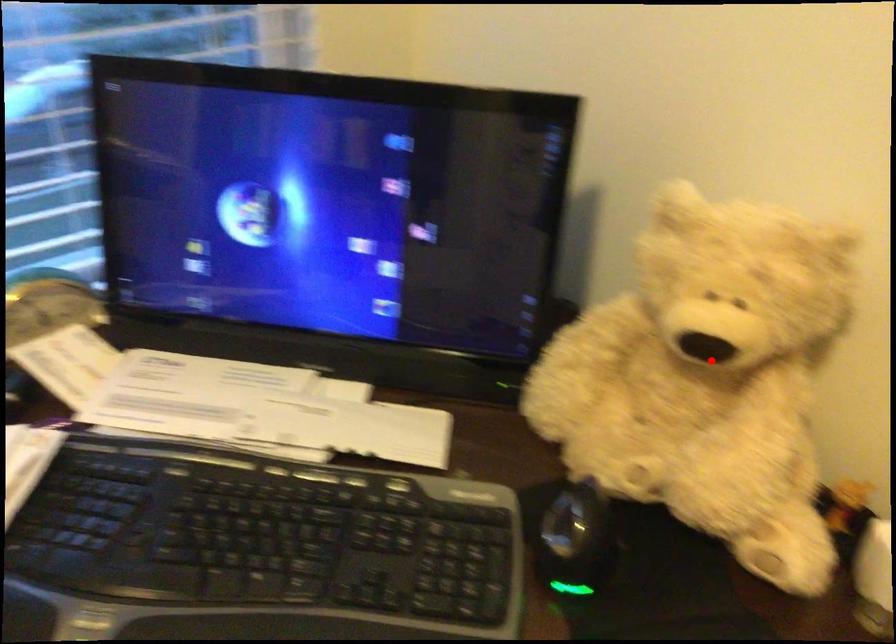
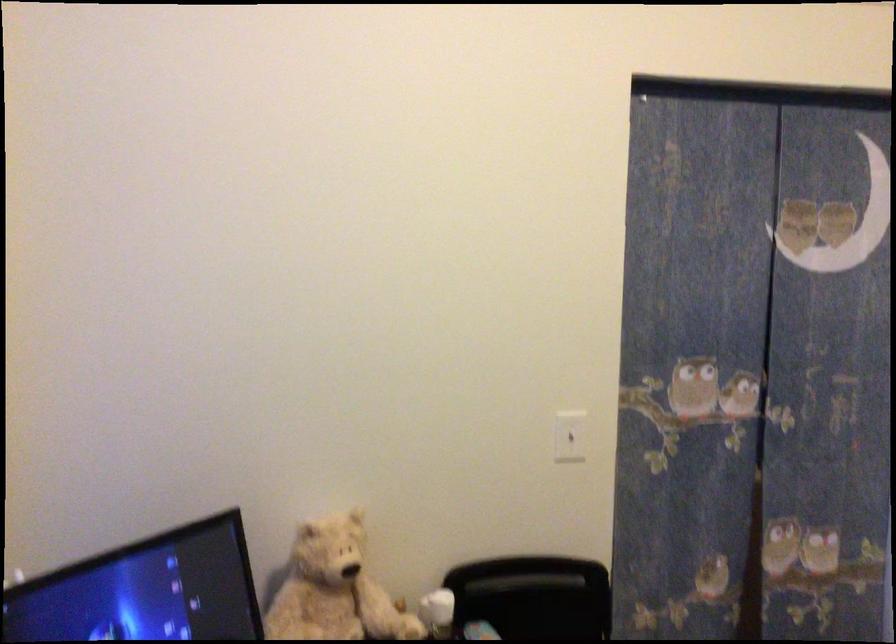
Where in the second image is the point corresponding to the highlighted location from the first image?

(334, 589)